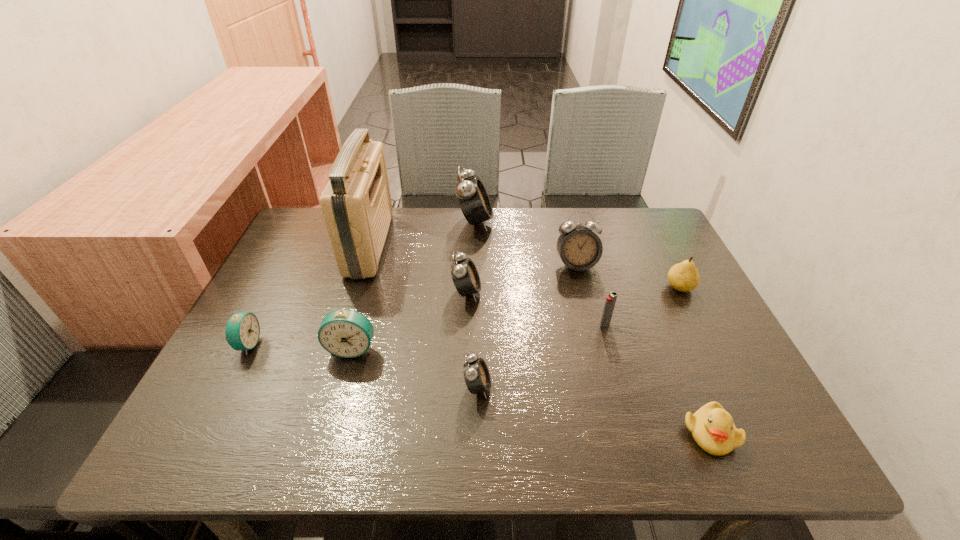
Where is `beige radio receiver`? This screenshot has width=960, height=540. beige radio receiver is located at coordinates (356, 203).

Locate an element on the screen. the tallest object is located at coordinates (356, 203).

This screenshot has width=960, height=540. In order to click on the tallest alarm clock in this screenshot , I will do `click(473, 199)`.

This screenshot has width=960, height=540. I want to click on the biggest white alarm clock, so click(473, 199).

Locate an element on the screen. The width and height of the screenshot is (960, 540). the fifth shortest alarm clock is located at coordinates (579, 248).

You are a GUI agent. You are given a task and a screenshot of the screen. Output one action in this format:
    pyautogui.click(x=<x>, y=<y>)
    Task: Click on the rightmost alarm clock
    
    Given the screenshot: What is the action you would take?
    pyautogui.click(x=579, y=248)

The image size is (960, 540). I want to click on the third farthest alarm clock, so click(x=465, y=276).

Where is `the second smallest white alarm clock`? the second smallest white alarm clock is located at coordinates (465, 276).

At what (x,y) coordinates should I click in order to perform the action: click on the second alarm clock from left to right. Please return your answer as a coordinate pair (x, y). Looking at the image, I should click on (345, 333).

The image size is (960, 540). In order to click on the right blue alarm clock in this screenshot , I will do `click(345, 333)`.